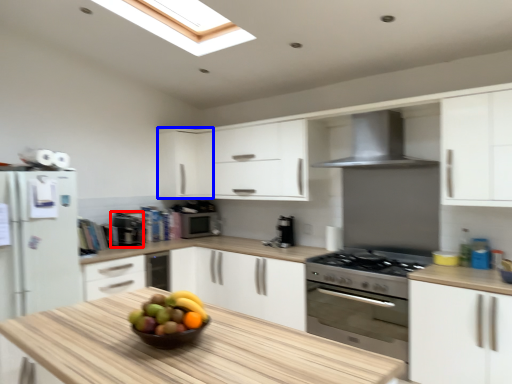
Question: Which object is closer to the camera taking this photo, appliance (highlighted by a red box) or cabinetry (highlighted by a blue box)?

Choices:
 (A) appliance
 (B) cabinetry

Answer: (A)